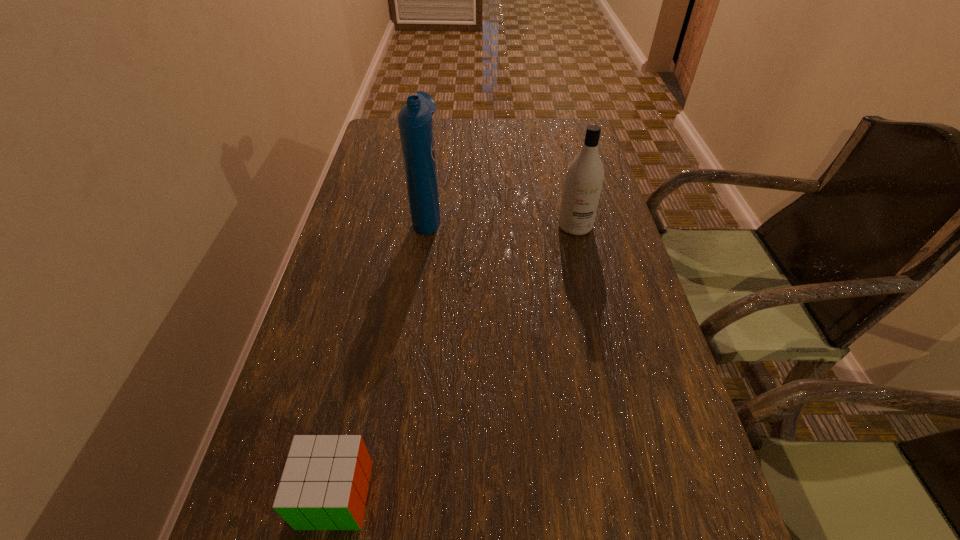
At what (x,y) coordinates should I click in order to perform the action: click on the left shampoo. Please return your answer as a coordinate pair (x, y). Looking at the image, I should click on (415, 121).

I want to click on the tallest object, so click(415, 121).

Image resolution: width=960 pixels, height=540 pixels. I want to click on the shorter shampoo, so click(x=584, y=178).

The image size is (960, 540). In order to click on the second tallest object in this screenshot , I will do `click(584, 178)`.

Where is `the shortest object`? The width and height of the screenshot is (960, 540). the shortest object is located at coordinates (324, 485).

Locate an element on the screen. the nearest object is located at coordinates (324, 485).

Locate an element on the screen. This screenshot has height=540, width=960. vacant point located 0.230m on the front of the left shampoo is located at coordinates (416, 304).

Find the location of `vacant space positioned on the front-facing side of the second shortest object`. vacant space positioned on the front-facing side of the second shortest object is located at coordinates (585, 265).

Identify the location of vacant point located 0.180m on the back of the nearest object. (362, 369).

At what (x,y) coordinates should I click in order to perform the action: click on object at the left edge. Please return your answer as a coordinate pair (x, y). This screenshot has width=960, height=540. Looking at the image, I should click on (324, 485).